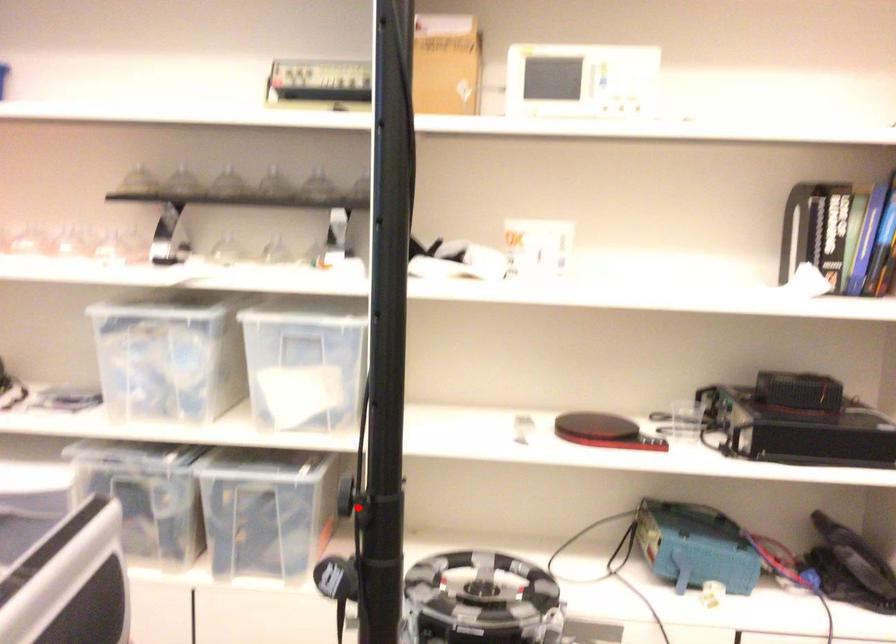
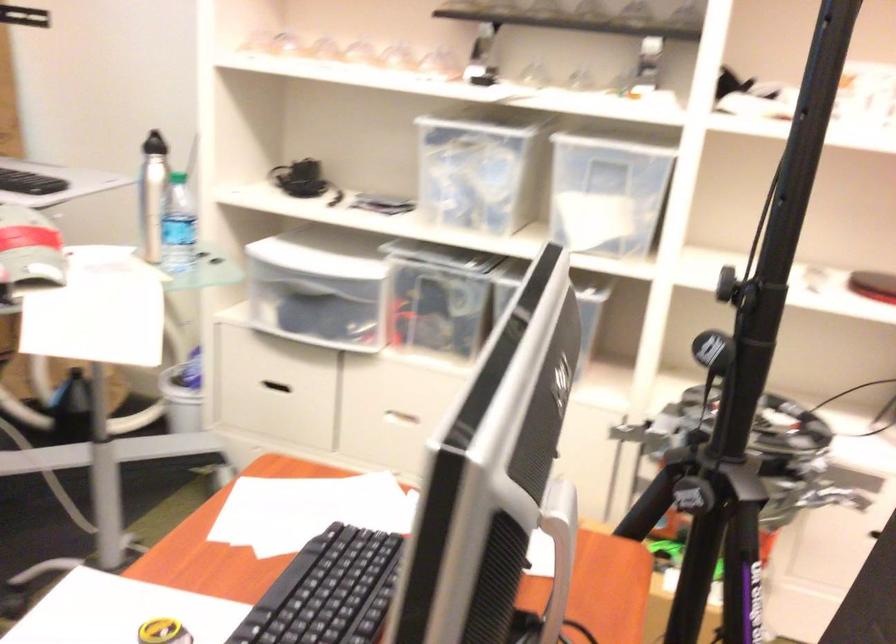
Question: I am providing you with two images of the same scene from different viewpoints. Given a red point in image1, look at the same physical point in image2. Is it:

Choices:
 (A) Closer to the viewpoint
 (B) Farther from the viewpoint

Answer: (B)